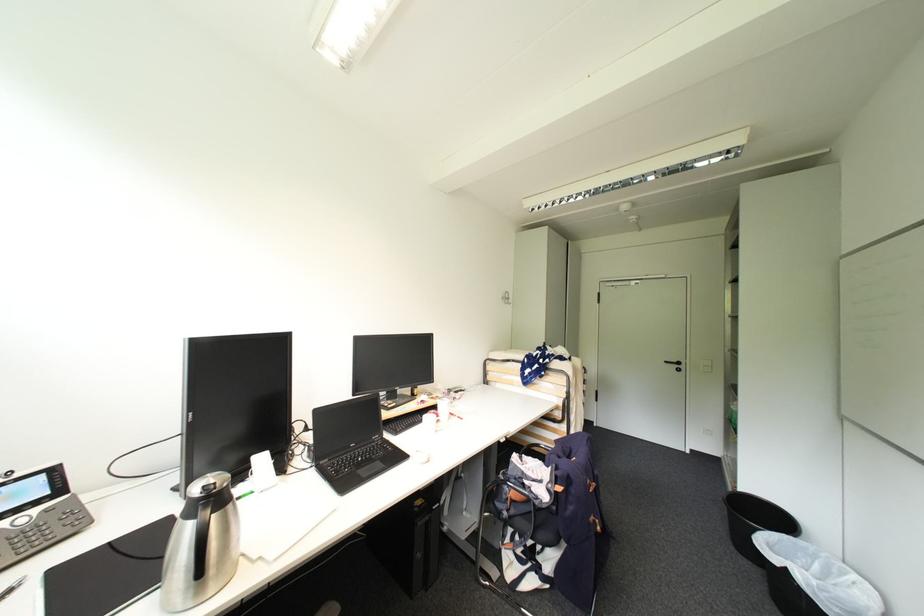
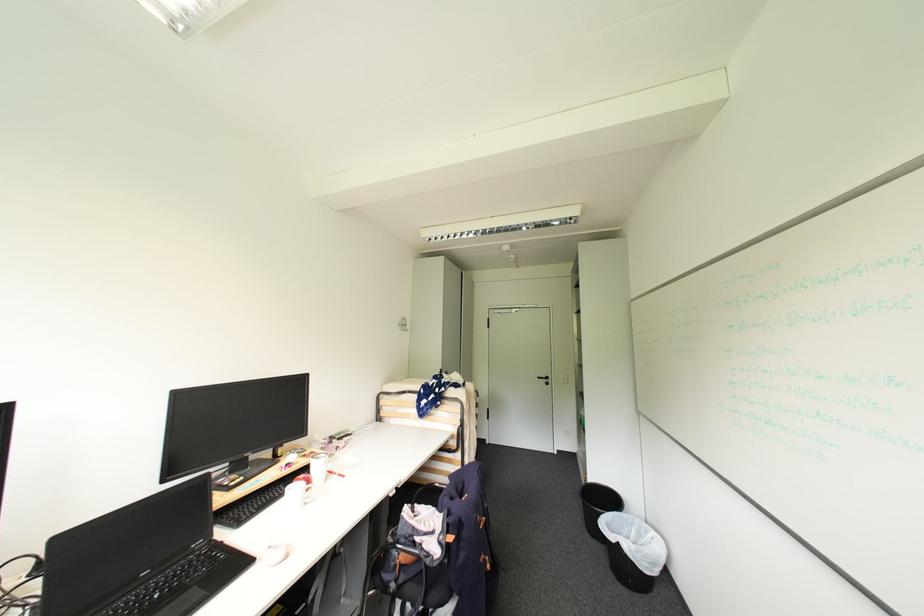
Where in the second image is the point corresponding to (463,418) from the first image?

(343, 477)